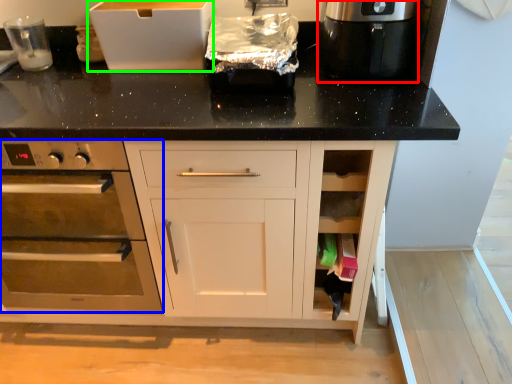
Question: Which object is the closest to the kitchen appliance (highlighted by a red box)? Choose among these: home appliance (highlighted by a blue box) or cardboard box (highlighted by a green box).

Choices:
 (A) home appliance
 (B) cardboard box

Answer: (B)